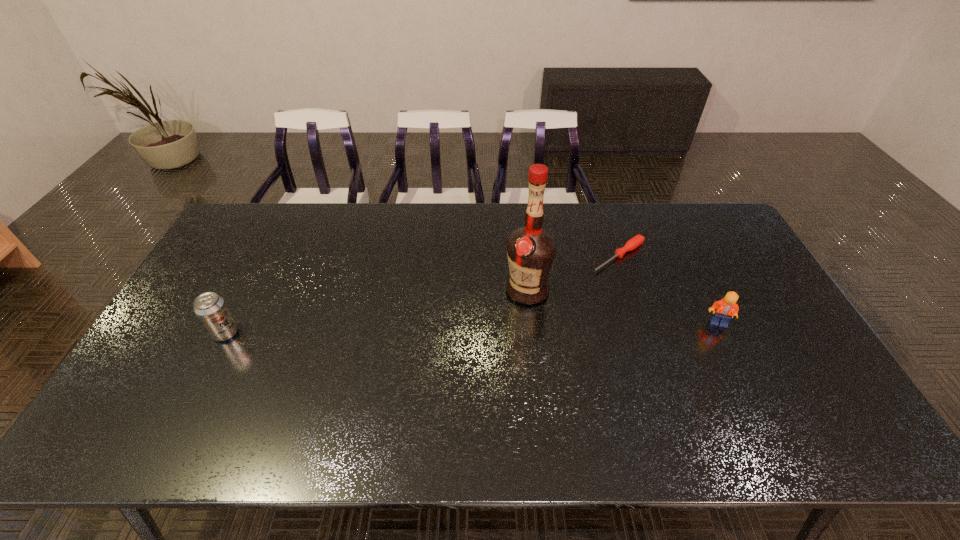
Where is `vacant space on the desktop that is between the beer can and the rightmost object and is positioned on the front and back of the third nearest object`? The width and height of the screenshot is (960, 540). vacant space on the desktop that is between the beer can and the rightmost object and is positioned on the front and back of the third nearest object is located at coordinates (452, 328).

The image size is (960, 540). Identify the location of free spot on the desktop that is between the beer can and the Lego and is positioned at the tip of the screwdriver. (518, 327).